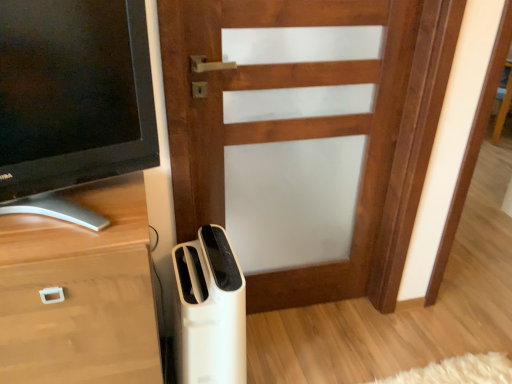
Question: Is wooden chest of drawers at lower left a part of white plastic air purifier at lower center?

Choices:
 (A) yes
 (B) no

Answer: (B)

Question: Considering the relative positions of white plastic air purifier at lower center and wooden chest of drawers at lower left in the image provided, is white plastic air purifier at lower center to the left of wooden chest of drawers at lower left from the viewer's perspective?

Choices:
 (A) no
 (B) yes

Answer: (A)

Question: From the image's perspective, would you say white plastic air purifier at lower center is positioned over wooden chest of drawers at lower left?

Choices:
 (A) yes
 (B) no

Answer: (B)

Question: Is white plastic air purifier at lower center wider than wooden chest of drawers at lower left?

Choices:
 (A) no
 (B) yes

Answer: (A)

Question: Is white plastic air purifier at lower center taller than wooden chest of drawers at lower left?

Choices:
 (A) yes
 (B) no

Answer: (B)

Question: From a real-world perspective, is white plastic air purifier at lower center positioned above or below wooden door at center?

Choices:
 (A) below
 (B) above

Answer: (A)

Question: Considering the positions of white plastic air purifier at lower center and wooden door at center in the image, is white plastic air purifier at lower center bigger or smaller than wooden door at center?

Choices:
 (A) big
 (B) small

Answer: (B)

Question: Considering the relative positions of white plastic air purifier at lower center and wooden door at center in the image provided, is white plastic air purifier at lower center to the left or to the right of wooden door at center?

Choices:
 (A) right
 (B) left

Answer: (B)

Question: From the image's perspective, is white plastic air purifier at lower center located above or below wooden door at center?

Choices:
 (A) above
 (B) below

Answer: (B)

Question: Looking at their shapes, would you say matte black tv at left is wider or thinner than wooden chest of drawers at lower left?

Choices:
 (A) wide
 (B) thin

Answer: (B)

Question: Does point (65, 44) appear closer or farther from the camera than point (130, 360)?

Choices:
 (A) farther
 (B) closer

Answer: (B)

Question: Is matte black tv at left taller or shorter than wooden chest of drawers at lower left?

Choices:
 (A) short
 (B) tall

Answer: (A)

Question: Considering the positions of matte black tv at left and wooden chest of drawers at lower left in the image, is matte black tv at left bigger or smaller than wooden chest of drawers at lower left?

Choices:
 (A) small
 (B) big

Answer: (A)

Question: From their relative heights in the image, would you say white plastic air purifier at lower center is taller or shorter than wooden chest of drawers at lower left?

Choices:
 (A) short
 (B) tall

Answer: (A)

Question: Looking at their shapes, would you say white plastic air purifier at lower center is wider or thinner than wooden chest of drawers at lower left?

Choices:
 (A) wide
 (B) thin

Answer: (B)